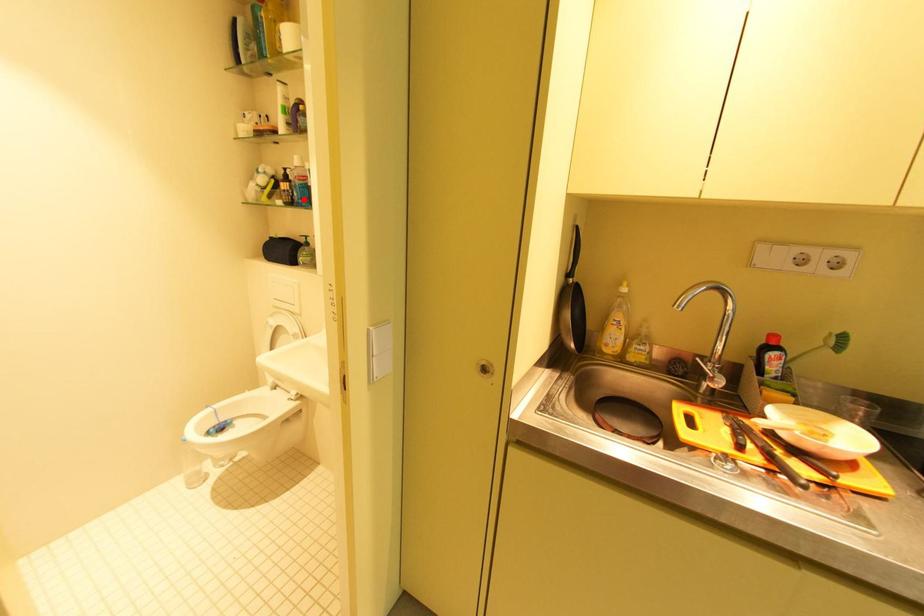
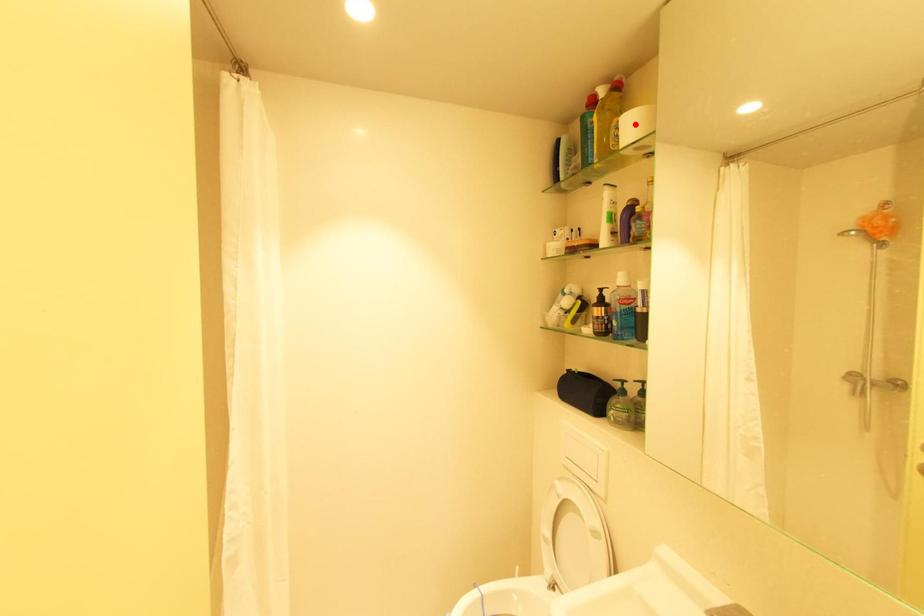
In the scene shown: I am providing you with two images of the same scene from different viewpoints. A red point is marked on the first image and another point is marked on the second image. Is the marked point in image1 the same physical position as the marked point in image2?

No